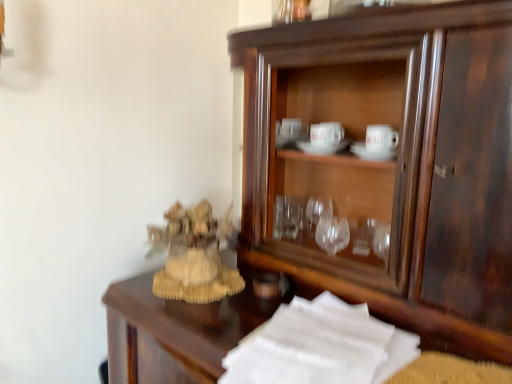
Question: In terms of size, does beige woven statue at left appear bigger or smaller than white paper at lower right?

Choices:
 (A) big
 (B) small

Answer: (A)

Question: Choose the correct answer: Is beige woven statue at left inside white paper at lower right or outside it?

Choices:
 (A) outside
 (B) inside

Answer: (A)

Question: Estimate the real-world distances between objects in this image. Which object is farther from the beige woven statue at left?

Choices:
 (A) dark wood cupboard at center
 (B) white paper at lower right

Answer: (A)

Question: Which of these objects is positioned closest to the white paper at lower right?

Choices:
 (A) beige woven statue at left
 (B) dark wood cupboard at center

Answer: (A)